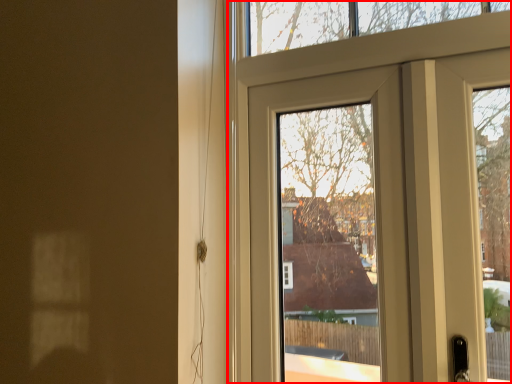
Question: From the image's perspective, what is the correct spatial positioning of door (annotated by the red box) in reference to door?

Choices:
 (A) above
 (B) below

Answer: (A)